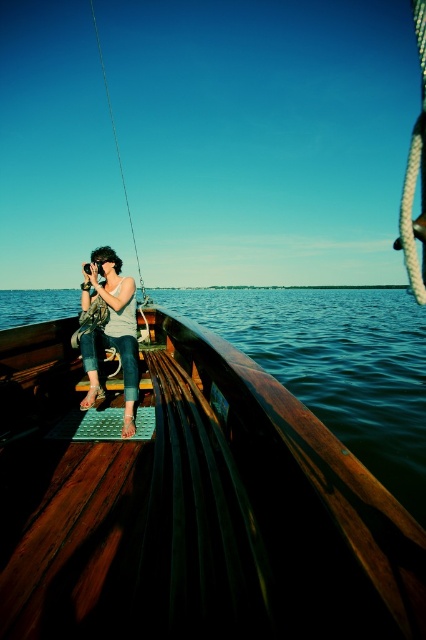
You are organizing a small picnic on the boat and need to place both the matte white tank top at center and the metallic wire fishing pole at upper left on a limited space. Which object should you choose to place first if you want to ensure both can fit without overlapping?

The matte white tank top at center occupies less space than the metallic wire fishing pole at upper left, so you should place the metallic wire fishing pole at upper left first to ensure both can fit without overlapping.

You are standing on the wooden boat at center and want to place the metallic wire fishing pole at upper left on the deck. Can the deck support the fishing pole horizontally without bending?

The wooden boat at center is thinner than the metallic wire fishing pole at upper left, so the deck might not be wide enough to support the fishing pole horizontally without bending.